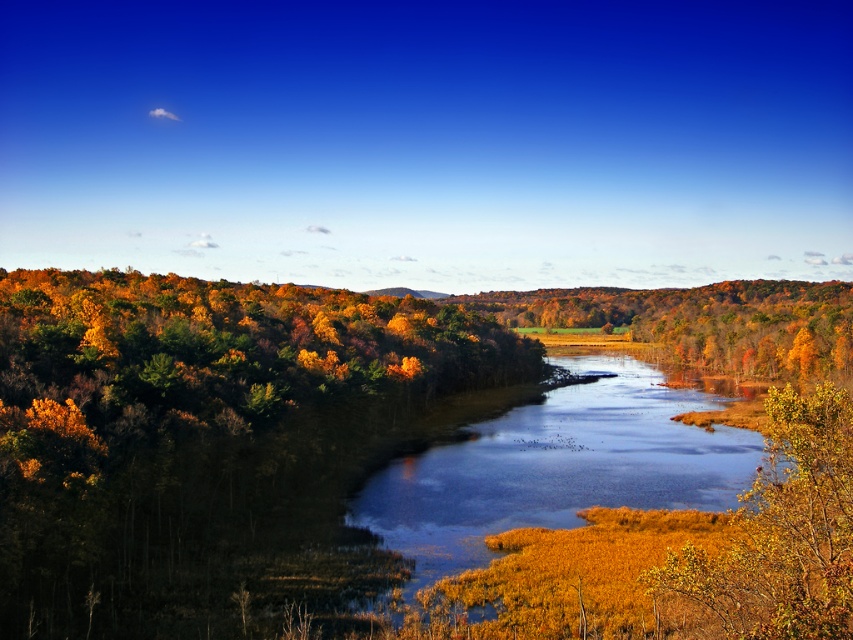
You are a hiker standing at the point with coordinates 0.5, 0.5 in this autumn landscape. You want to reach the golden grassy river at center. Which direction should you move to get closer to it?

The golden grassy river at center is located at point [556,467]. Since your current position is [426,320], you should move towards the northeast direction to reach it.

You are a hiker trying to cross the river. You have a 10 feet wide raft. The golden grassy river at center is in front of you, and the golden textured leaves at lower right are on your right side. Can your raft fit across the river at the point where you are standing?

The golden grassy river at center is wider than the golden textured leaves at lower right. Since the raft is 10 feet wide, it depends on the actual width of the river at that point. However, since the river is wider than the leaves area, if the river at your position is narrower than 10 feet, the raft can fit. But without exact measurements, we can only say the river is wider than the leaves area.

You are an artist planning to paint the autumn landscape. You want to ensure the golden grassy river at center and the golden textured leaves at lower right are proportionally accurate. Which object should you depict as larger in your painting?

The golden grassy river at center should be depicted as larger than the golden textured leaves at lower right because it has a larger size compared to them according to the description.